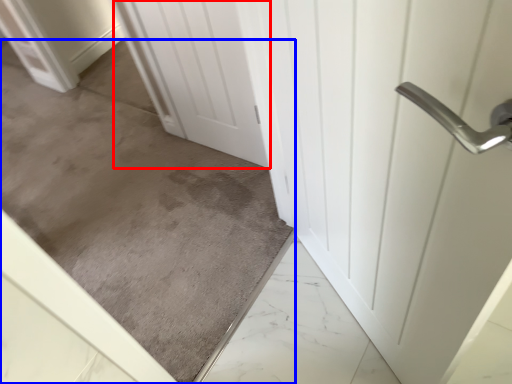
Question: Which object appears closest to the camera in this image, door (highlighted by a red box) or concrete (highlighted by a blue box)?

Choices:
 (A) door
 (B) concrete

Answer: (B)